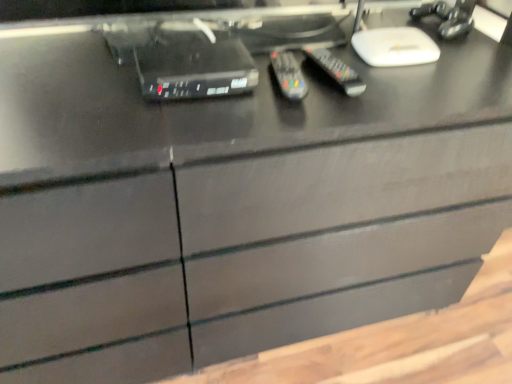
Question: From a real-world perspective, is black plastic remote at center, acting as the first control starting from the right, positioned over black plastic remote at center, placed as the 1th control when sorted from left to right, based on gravity?

Choices:
 (A) yes
 (B) no

Answer: (A)

Question: Is black plastic remote at center, acting as the first control starting from the right, oriented away from black plastic remote at center, placed as the second control when sorted from right to left?

Choices:
 (A) no
 (B) yes

Answer: (A)

Question: Considering the relative sizes of black plastic remote at center, acting as the first control starting from the right, and black plastic remote at center, placed as the 1th control when sorted from left to right, in the image provided, is black plastic remote at center, acting as the first control starting from the right, taller than black plastic remote at center, placed as the 1th control when sorted from left to right,?

Choices:
 (A) no
 (B) yes

Answer: (B)

Question: Is black plastic remote at center, the second control when ordered from left to right, closer to camera compared to black plastic remote at center, placed as the second control when sorted from right to left?

Choices:
 (A) yes
 (B) no

Answer: (B)

Question: Is black plastic remote at center, acting as the first control starting from the right, completely or partially outside of black plastic remote at center, placed as the second control when sorted from right to left?

Choices:
 (A) no
 (B) yes

Answer: (B)

Question: In terms of width, does black plastic remote at center, placed as the second control when sorted from right to left, look wider or thinner when compared to black plastic remote at center, the second control when ordered from left to right?

Choices:
 (A) thin
 (B) wide

Answer: (A)

Question: Would you say black plastic remote at center, placed as the 1th control when sorted from left to right, is to the left or to the right of black plastic remote at center, the second control when ordered from left to right, in the picture?

Choices:
 (A) left
 (B) right

Answer: (A)

Question: From the image's perspective, is black plastic remote at center, placed as the 1th control when sorted from left to right, above or below black plastic remote at center, acting as the first control starting from the right?

Choices:
 (A) above
 (B) below

Answer: (B)

Question: Is black plastic remote at center, placed as the second control when sorted from right to left, taller or shorter than black plastic remote at center, the second control when ordered from left to right?

Choices:
 (A) short
 (B) tall

Answer: (A)

Question: From a real-world perspective, is black plastic remote at center, placed as the 1th control when sorted from left to right, physically located above or below black plastic device at upper center?

Choices:
 (A) above
 (B) below

Answer: (B)

Question: In terms of width, does black plastic remote at center, placed as the 1th control when sorted from left to right, look wider or thinner when compared to black plastic device at upper center?

Choices:
 (A) wide
 (B) thin

Answer: (A)

Question: Is black plastic remote at center, placed as the second control when sorted from right to left, bigger or smaller than black plastic device at upper center?

Choices:
 (A) small
 (B) big

Answer: (A)

Question: Relative to black plastic device at upper center, is black plastic remote at center, placed as the second control when sorted from right to left, in front or behind?

Choices:
 (A) behind
 (B) front

Answer: (A)

Question: Based on their sizes in the image, would you say black plastic remote at center, the second control when ordered from left to right, is bigger or smaller than black plastic remote at center, placed as the second control when sorted from right to left?

Choices:
 (A) big
 (B) small

Answer: (A)

Question: Would you say black plastic remote at center, the second control when ordered from left to right, is to the left or to the right of black plastic remote at center, placed as the 1th control when sorted from left to right, in the picture?

Choices:
 (A) left
 (B) right

Answer: (B)